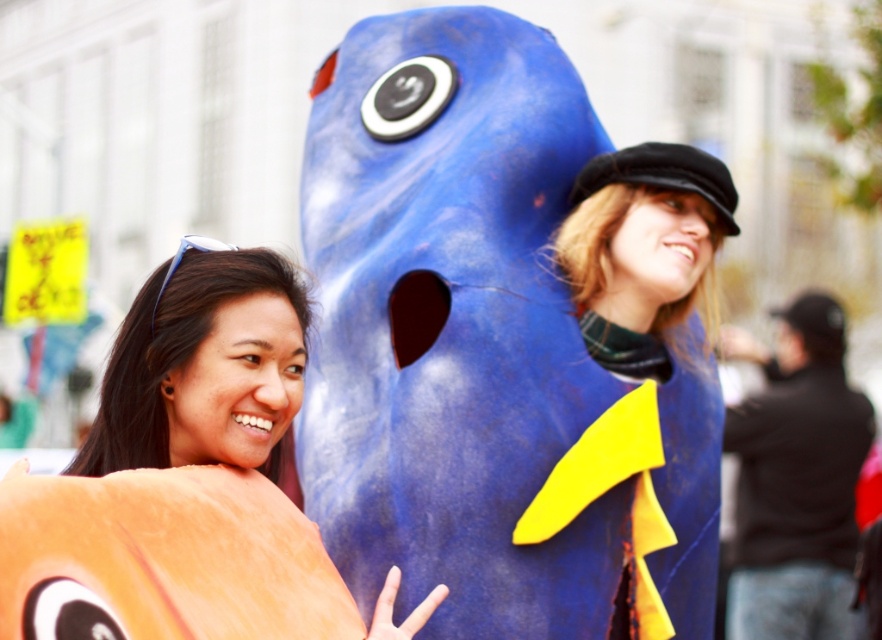
Is matte orange plush at left taller than matte blue costume at center?

Yes, matte orange plush at left is taller than matte blue costume at center.

Describe the element at coordinates (185, 481) in the screenshot. I see `matte orange plush at left` at that location.

What are the coordinates of `matte orange plush at left` in the screenshot? It's located at click(185, 481).